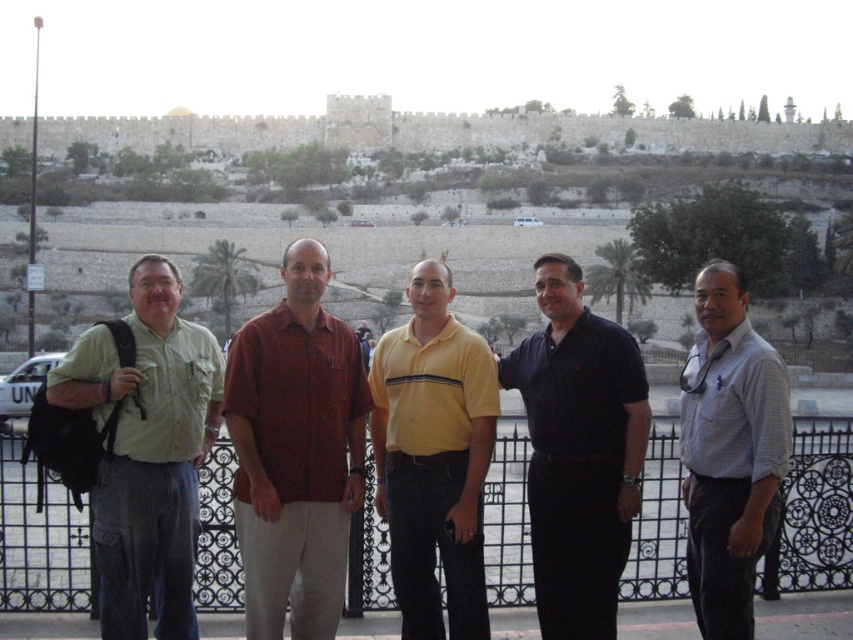
Question: Among these points, which one is nearest to the camera?

Choices:
 (A) (61, 385)
 (B) (639, 353)
 (C) (361, 410)

Answer: (A)

Question: Can you confirm if black matte shirt at center is wider than white checkered shirt at right?

Choices:
 (A) yes
 (B) no

Answer: (B)

Question: Is black matte shirt at center wider than white checkered shirt at right?

Choices:
 (A) no
 (B) yes

Answer: (A)

Question: Can you confirm if black metal fence at center is smaller than yellow cotton polo shirt at center?

Choices:
 (A) yes
 (B) no

Answer: (B)

Question: Which of the following is the farthest from the observer?

Choices:
 (A) (329, 490)
 (B) (770, 499)

Answer: (A)

Question: Which point appears farthest from the camera in this image?

Choices:
 (A) (334, 364)
 (B) (138, 616)

Answer: (A)